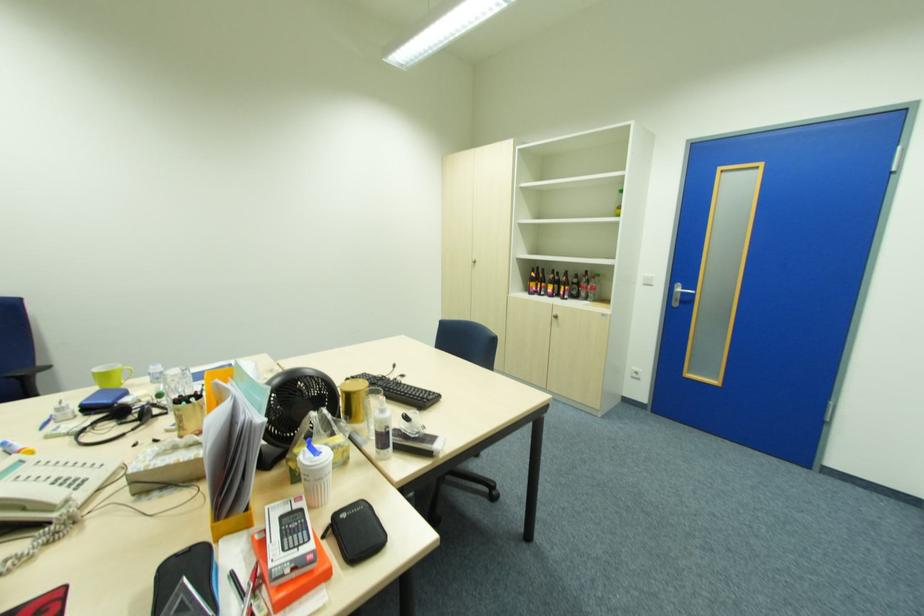
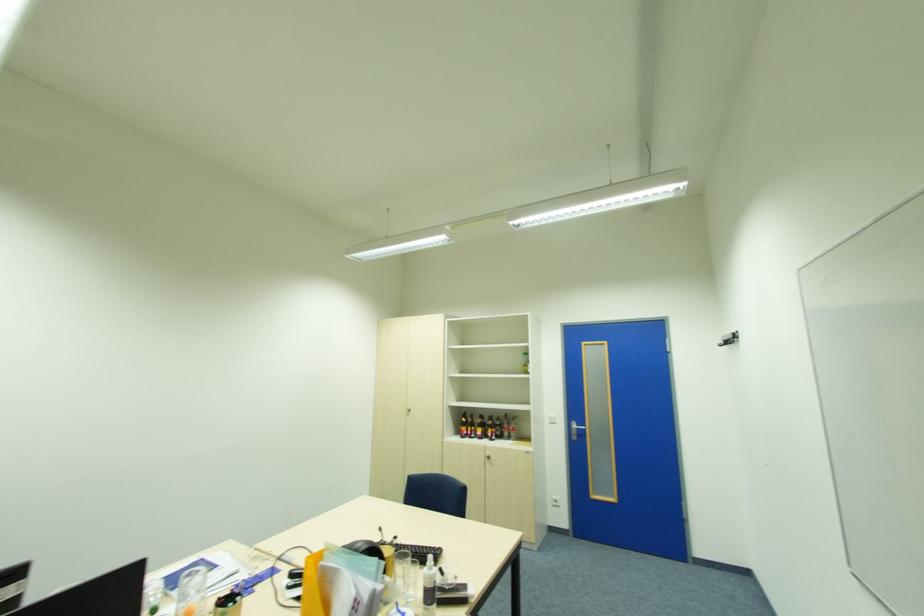
The images are taken continuously from a first-person perspective. In which direction are you moving?

The cameraman walked toward left, backward.